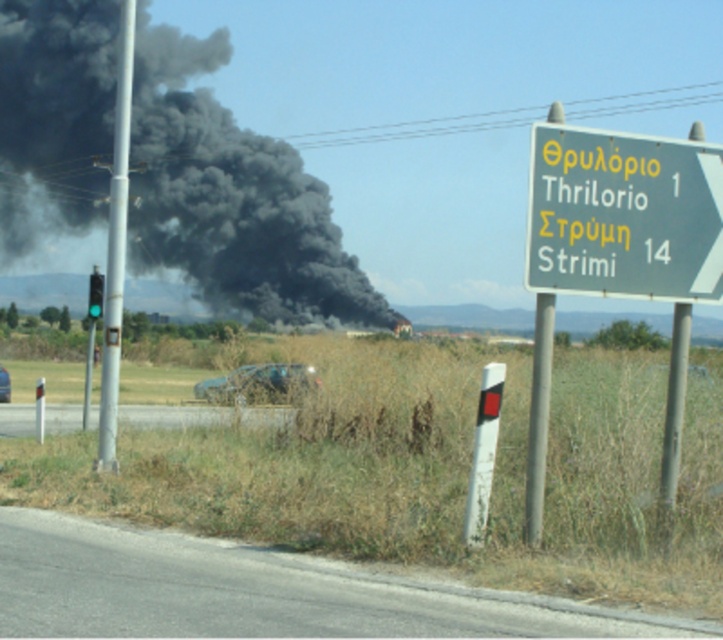
Can you confirm if green metallic sign at upper right is positioned above green glass traffic light at left?

Yes.

Can you confirm if green metallic sign at upper right is positioned below green glass traffic light at left?

No, green metallic sign at upper right is not below green glass traffic light at left.

Does point (709, 182) come closer to viewer compared to point (87, 310)?

Yes, it is in front of point (87, 310).

You are a GUI agent. You are given a task and a screenshot of the screen. Output one action in this format:
    pyautogui.click(x=<x>, y=<y>)
    Task: Click on the green metallic sign at upper right
    The height and width of the screenshot is (640, 723).
    Given the screenshot: What is the action you would take?
    pyautogui.click(x=617, y=253)

Does point (184, 413) lie in front of point (4, 372)?

Yes, it is.

At what (x,y) coordinates should I click in order to perform the action: click on gray asphalt road at lower center. Please return your answer as a coordinate pair (x, y). The width and height of the screenshot is (723, 640). Looking at the image, I should click on (202, 416).

Does green plastic sign at upper right have a greater width compared to gray asphalt road at lower center?

Indeed, green plastic sign at upper right has a greater width compared to gray asphalt road at lower center.

Between green plastic sign at upper right and gray asphalt road at lower center, which one appears on the right side from the viewer's perspective?

Positioned to the right is green plastic sign at upper right.

The image size is (723, 640). Identify the location of green plastic sign at upper right. (623, 216).